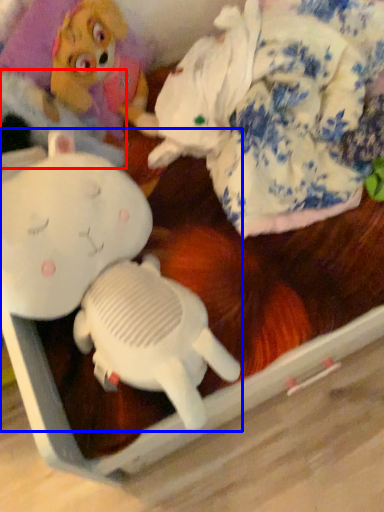
Question: Which object appears closest to the camera in this image, clothing (highlighted by a red box) or toy (highlighted by a blue box)?

Choices:
 (A) clothing
 (B) toy

Answer: (B)